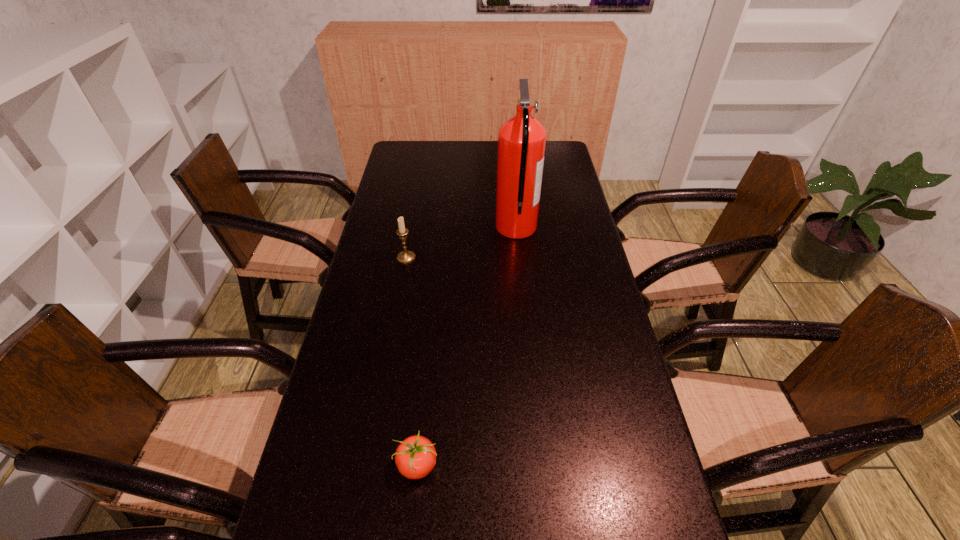
Where is `free space that satisfies the following two spatial constraints: 1. on the front side of the tomato; 2. on the right side of the leftmost object`? The height and width of the screenshot is (540, 960). free space that satisfies the following two spatial constraints: 1. on the front side of the tomato; 2. on the right side of the leftmost object is located at coordinates (369, 465).

Locate an element on the screen. The image size is (960, 540). vacant region that satisfies the following two spatial constraints: 1. at the nozzle of the farthest object; 2. on the front side of the candle holder is located at coordinates (519, 258).